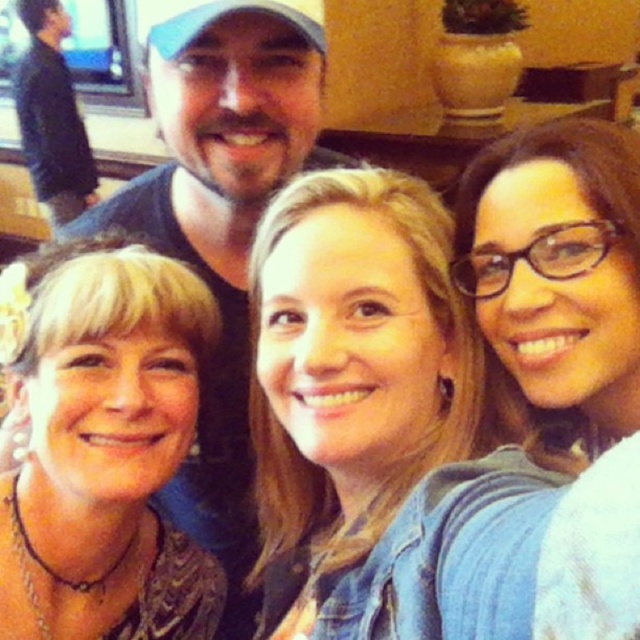
Between matte black shirt at left and black sweater at upper left, which one is positioned higher?

Positioned higher is black sweater at upper left.

Does point (12, 618) come closer to viewer compared to point (61, 17)?

Yes.

Locate an element on the screen. matte black shirt at left is located at coordinates (102, 445).

Where is `matte black shirt at left`? matte black shirt at left is located at coordinates (102, 445).